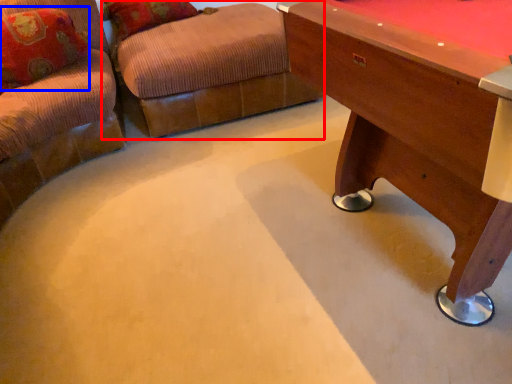
Question: Among these objects, which one is nearest to the camera, swivel chair (highlighted by a red box) or pillow (highlighted by a blue box)?

Choices:
 (A) swivel chair
 (B) pillow

Answer: (B)